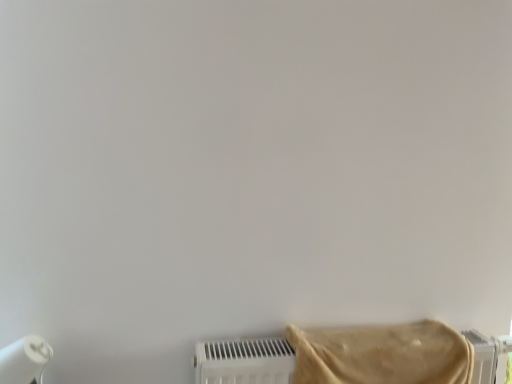
Question: Is white matte paper towel at lower left taller or shorter than beige fabric towel at lower right?

Choices:
 (A) tall
 (B) short

Answer: (A)

Question: In terms of width, does white matte paper towel at lower left look wider or thinner when compared to beige fabric towel at lower right?

Choices:
 (A) wide
 (B) thin

Answer: (B)

Question: Would you say white matte paper towel at lower left is to the left or to the right of beige fabric towel at lower right in the picture?

Choices:
 (A) left
 (B) right

Answer: (A)

Question: Is beige fabric towel at lower right situated inside white matte paper towel at lower left or outside?

Choices:
 (A) outside
 (B) inside

Answer: (A)

Question: From a real-world perspective, is beige fabric towel at lower right above or below white matte paper towel at lower left?

Choices:
 (A) below
 (B) above

Answer: (B)

Question: From their relative heights in the image, would you say beige fabric towel at lower right is taller or shorter than white matte paper towel at lower left?

Choices:
 (A) short
 (B) tall

Answer: (A)

Question: Is beige fabric towel at lower right in front of or behind white matte paper towel at lower left in the image?

Choices:
 (A) front
 (B) behind

Answer: (A)